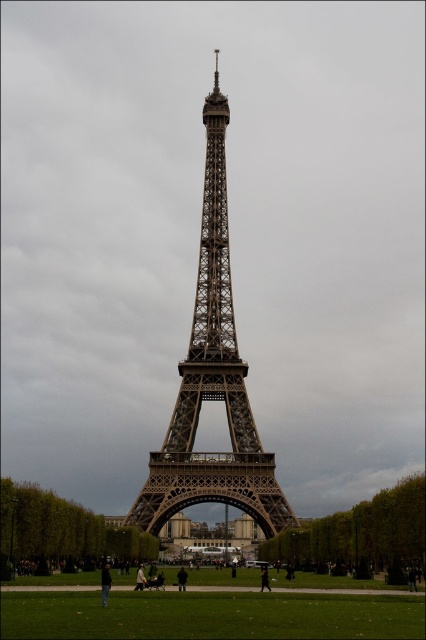
Is point (241, 401) farther from camera compared to point (100, 593)?

No, it is in front of (100, 593).

Who is lower down, brown metal eiffel tower at center or dark brown leather jacket at lower center?

dark brown leather jacket at lower center is lower down.

At what (x,y) coordinates should I click in order to perform the action: click on brown metal eiffel tower at center. Please return your answer as a coordinate pair (x, y). The width and height of the screenshot is (426, 640). Looking at the image, I should click on (212, 381).

Does green grass at lower center appear under dark gray fabric jacket at lower center?

No, green grass at lower center is not below dark gray fabric jacket at lower center.

Is green grass at lower center further to the viewer compared to dark gray fabric jacket at lower center?

No.

The image size is (426, 640). Describe the element at coordinates (207, 616) in the screenshot. I see `green grass at lower center` at that location.

At what (x,y) coordinates should I click in order to perform the action: click on green grass at lower center. Please return your answer as a coordinate pair (x, y). Looking at the image, I should click on (207, 616).

Which is more to the left, green grass at lower center or brown metal eiffel tower at center?

From the viewer's perspective, brown metal eiffel tower at center appears more on the left side.

Who is higher up, green grass at lower center or brown metal eiffel tower at center?

Positioned higher is brown metal eiffel tower at center.

Does point (190, 604) come in front of point (201, 300)?

Yes, point (190, 604) is in front of point (201, 300).

The width and height of the screenshot is (426, 640). Find the location of `green grass at lower center`. green grass at lower center is located at coordinates (207, 616).